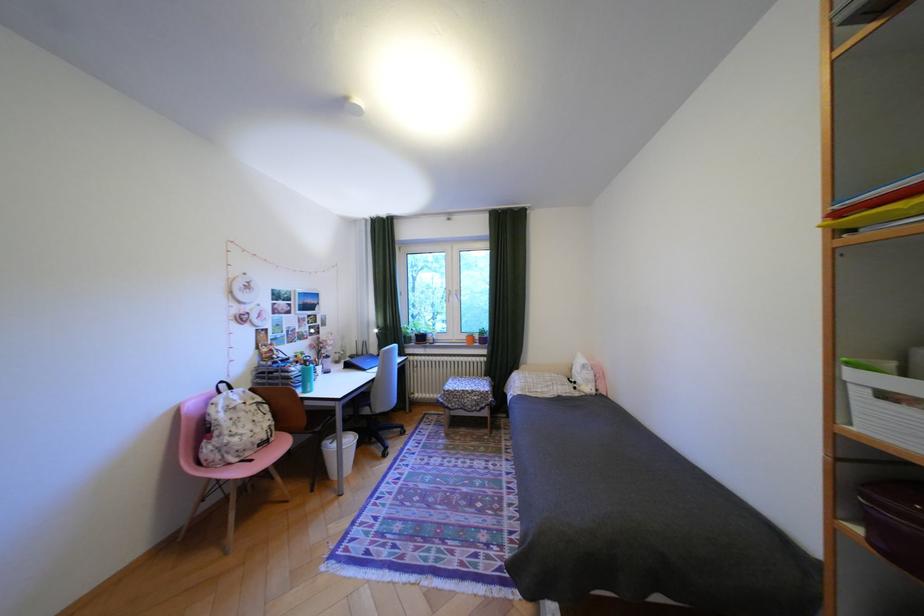
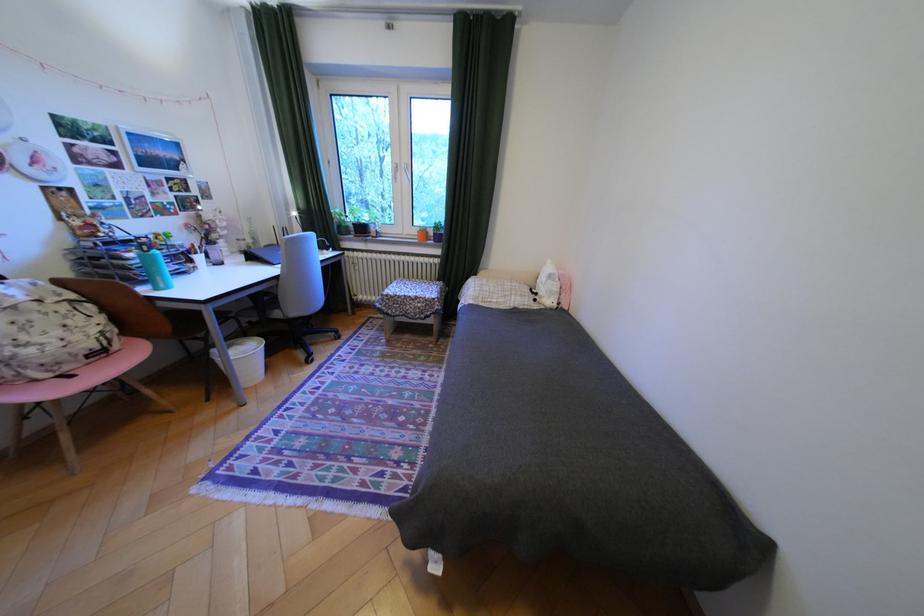
Find the pixel in the second image that matches (x=587, y=383) in the first image.

(548, 294)